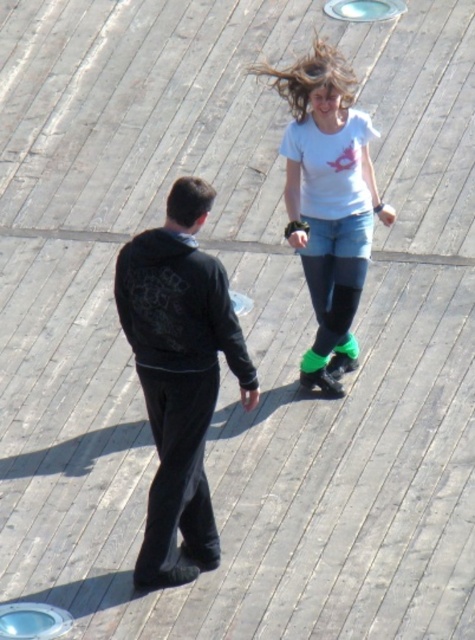
From the picture: Can you confirm if black matte jacket at center is wider than white matte t-shirt at upper center?

No, black matte jacket at center is not wider than white matte t-shirt at upper center.

In the scene shown: Is black matte jacket at center bigger than white matte t-shirt at upper center?

Actually, black matte jacket at center might be smaller than white matte t-shirt at upper center.

Describe the element at coordinates (180, 376) in the screenshot. I see `black matte jacket at center` at that location.

At what (x,y) coordinates should I click in order to perform the action: click on black matte jacket at center. Please return your answer as a coordinate pair (x, y). Image resolution: width=475 pixels, height=640 pixels. Looking at the image, I should click on (180, 376).

Is black matte jacket at center thinner than green fabric sock at center?

No, black matte jacket at center is not thinner than green fabric sock at center.

Is black matte jacket at center closer to the viewer compared to green fabric sock at center?

Yes, black matte jacket at center is in front of green fabric sock at center.

Image resolution: width=475 pixels, height=640 pixels. I want to click on black matte jacket at center, so [x=180, y=376].

Find the location of a particular element. The height and width of the screenshot is (640, 475). black matte jacket at center is located at coordinates (180, 376).

Who is taller, white matte t-shirt at upper center or green fabric sock at center?

With more height is white matte t-shirt at upper center.

Is white matte t-shirt at upper center to the left of green fabric sock at center from the viewer's perspective?

Incorrect, white matte t-shirt at upper center is not on the left side of green fabric sock at center.

Is point (335, 234) positioned in front of point (321, 368)?

Yes, point (335, 234) is closer to viewer.

Image resolution: width=475 pixels, height=640 pixels. Identify the location of white matte t-shirt at upper center. (328, 198).